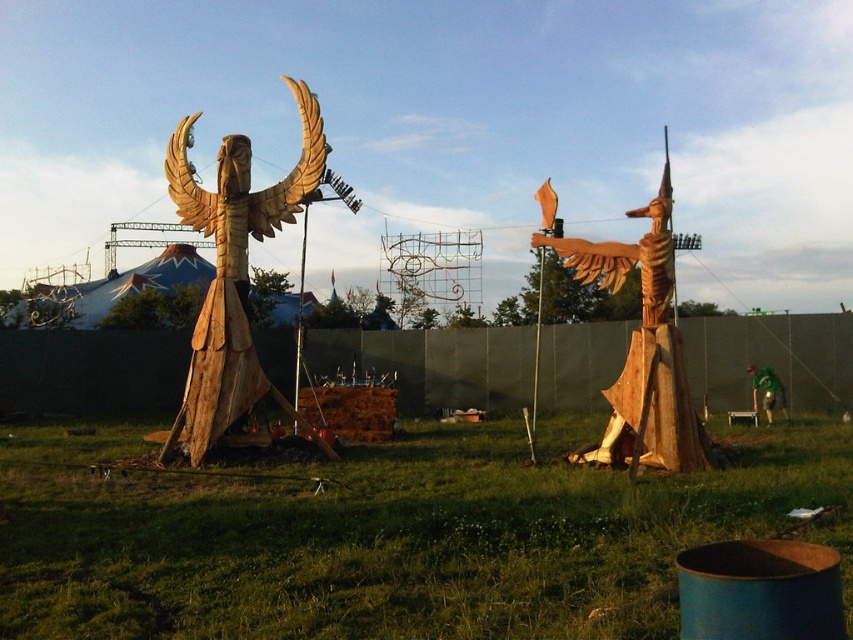
Who is positioned more to the right, green grass at center or wooden bird at center?

Positioned to the right is wooden bird at center.

Can you confirm if green grass at center is shorter than wooden bird at center?

Yes, green grass at center is shorter than wooden bird at center.

At what (x,y) coordinates should I click in order to perform the action: click on green grass at center. Please return your answer as a coordinate pair (x, y). Image resolution: width=853 pixels, height=640 pixels. Looking at the image, I should click on (398, 541).

The height and width of the screenshot is (640, 853). What are the coordinates of `green grass at center` in the screenshot? It's located at (398, 541).

Image resolution: width=853 pixels, height=640 pixels. Describe the element at coordinates (398, 541) in the screenshot. I see `green grass at center` at that location.

Which of these two, green grass at center or wooden statue at left, stands shorter?

With less height is green grass at center.

Is point (834, 467) farther from viewer compared to point (306, 163)?

That is False.

You are a GUI agent. You are given a task and a screenshot of the screen. Output one action in this format:
    pyautogui.click(x=<x>, y=<y>)
    Task: Click on the green grass at center
    
    Given the screenshot: What is the action you would take?
    pyautogui.click(x=398, y=541)

Between point (260, 384) and point (654, 444), which one is positioned behind?

Positioned behind is point (260, 384).

Does wooden statue at left have a lesser height compared to wooden bird at center?

No, wooden statue at left is not shorter than wooden bird at center.

The width and height of the screenshot is (853, 640). I want to click on wooden statue at left, so click(x=233, y=275).

You are a GUI agent. You are given a task and a screenshot of the screen. Output one action in this format:
    pyautogui.click(x=<x>, y=<y>)
    Task: Click on the wooden statue at left
    
    Given the screenshot: What is the action you would take?
    pyautogui.click(x=233, y=275)